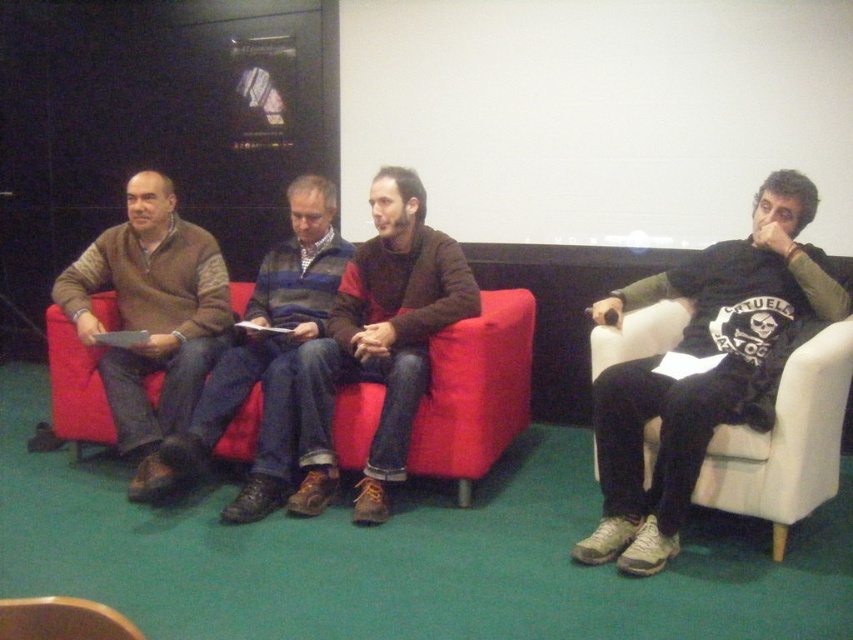
Does matte brown sweater at left have a greater height compared to brown leather armchair at lower left?

Yes, matte brown sweater at left is taller than brown leather armchair at lower left.

This screenshot has width=853, height=640. I want to click on matte brown sweater at left, so click(267, 355).

Where is `matte brown sweater at left`? matte brown sweater at left is located at coordinates (267, 355).

Is black cotton shirt at right shorter than red fabric couch at center?

Incorrect, black cotton shirt at right's height does not fall short of red fabric couch at center's.

Does black cotton shirt at right have a greater width compared to red fabric couch at center?

Correct, the width of black cotton shirt at right exceeds that of red fabric couch at center.

Is point (779, 330) positioned after point (439, 378)?

No, (779, 330) is closer to viewer.

I want to click on black cotton shirt at right, so click(x=703, y=369).

Which is above, black cotton shirt at right or brown leather jacket at center?

brown leather jacket at center is higher up.

Does black cotton shirt at right have a smaller size compared to brown leather jacket at center?

No.

Image resolution: width=853 pixels, height=640 pixels. I want to click on black cotton shirt at right, so click(x=703, y=369).

This screenshot has width=853, height=640. What are the coordinates of `black cotton shirt at right` in the screenshot? It's located at (703, 369).